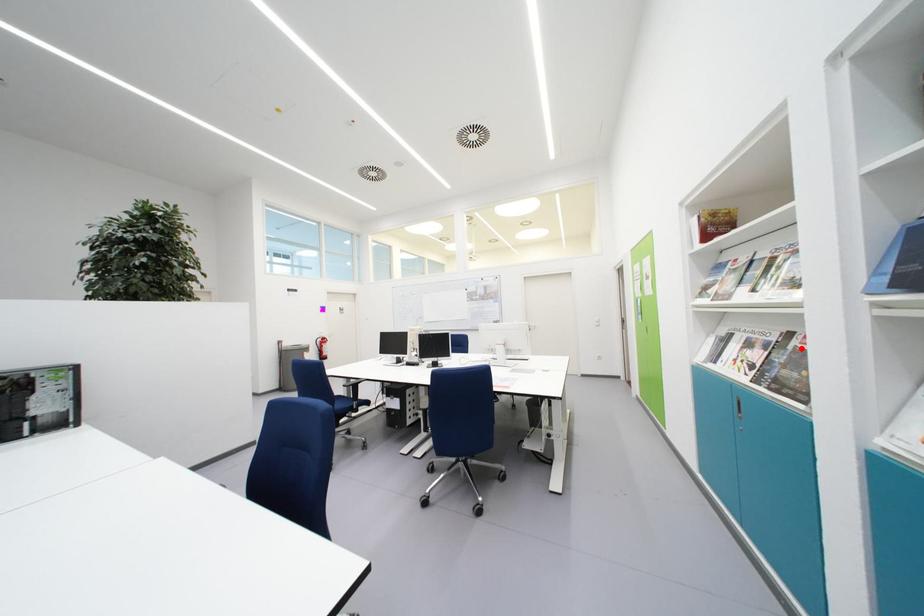
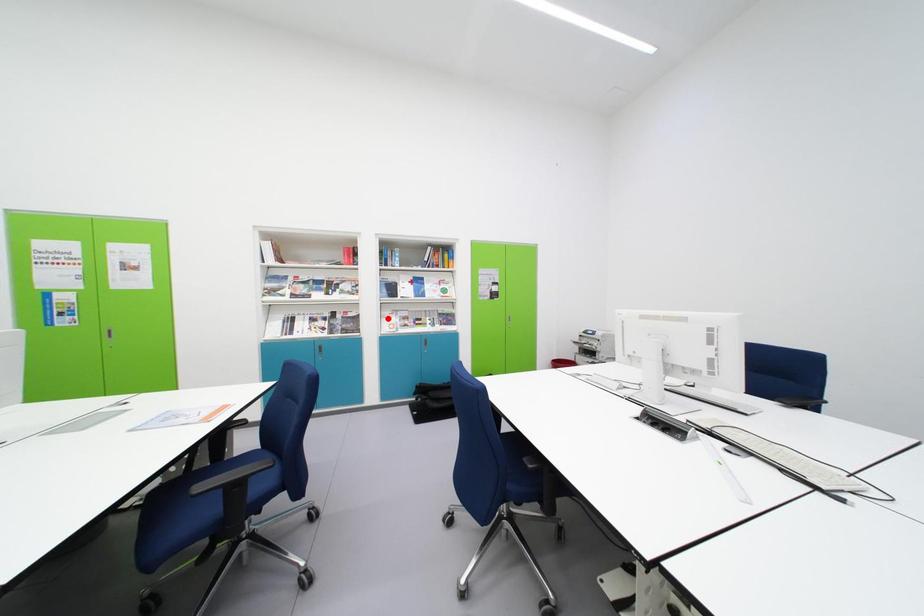
I am providing you with two images of the same scene from different viewpoints. A red point is marked on the first image and another point is marked on the second image. Are the points marked in image1 and image2 representing the same 3D position?

No